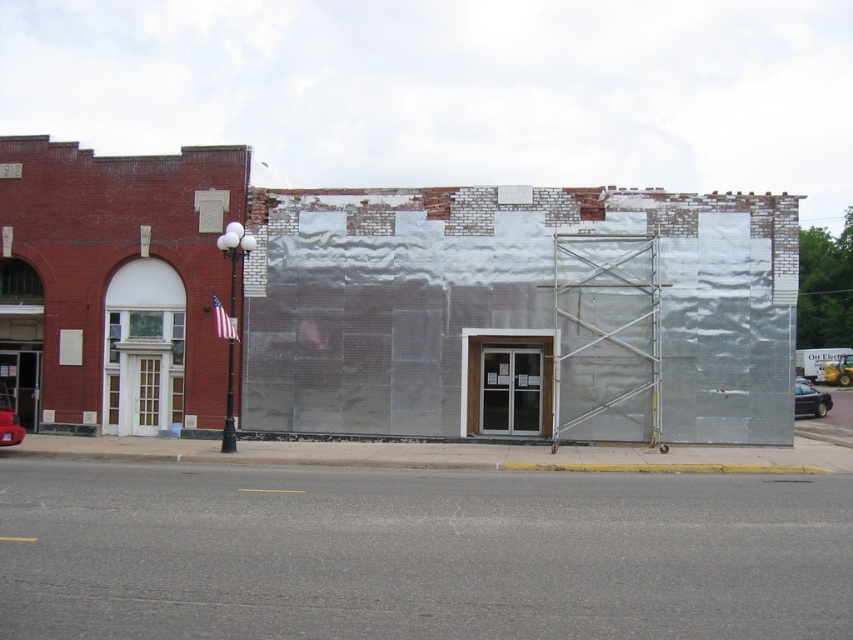
Question: Is shiny black sedan at lower right positioned behind metallic red car at lower left?

Choices:
 (A) no
 (B) yes

Answer: (B)

Question: Does shiny black sedan at lower right have a lesser width compared to metallic red car at lower left?

Choices:
 (A) yes
 (B) no

Answer: (B)

Question: Which object appears closest to the camera in this image?

Choices:
 (A) shiny black sedan at lower right
 (B) metallic red car at lower left

Answer: (B)

Question: Does shiny black sedan at lower right appear on the left side of metallic red car at lower left?

Choices:
 (A) no
 (B) yes

Answer: (A)